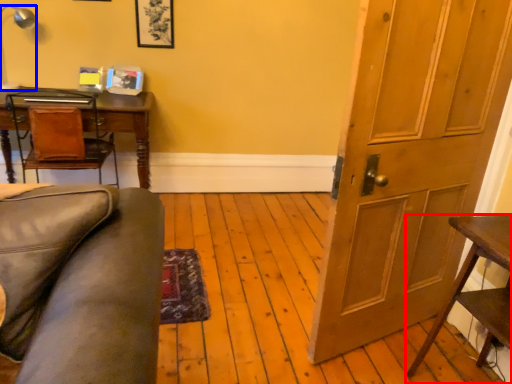
Question: Which point is closer to the camera, table (highlighted by a red box) or lamp (highlighted by a blue box)?

Choices:
 (A) table
 (B) lamp

Answer: (A)